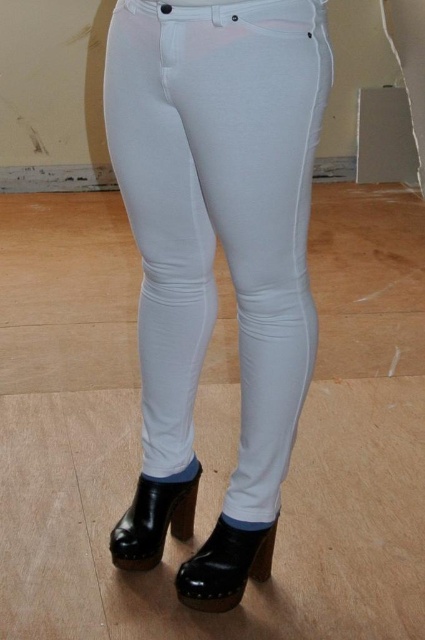
Does white smooth pants at center appear over black leather boot at lower center?

Indeed, white smooth pants at center is positioned over black leather boot at lower center.

Image resolution: width=425 pixels, height=640 pixels. What do you see at coordinates (220, 216) in the screenshot?
I see `white smooth pants at center` at bounding box center [220, 216].

Does point (178, 164) come closer to viewer compared to point (163, 502)?

That is True.

Find the location of a particular element. Image resolution: width=425 pixels, height=640 pixels. white smooth pants at center is located at coordinates (220, 216).

Does glossy patent leather boot at lower center have a smaller size compared to black leather boot at lower center?

Correct, glossy patent leather boot at lower center occupies less space than black leather boot at lower center.

Which is in front, point (209, 584) or point (122, 541)?

Point (209, 584) is in front.

Identify the location of glossy patent leather boot at lower center. (226, 566).

Can you confirm if white smooth pants at center is taller than glossy patent leather boot at lower center?

Correct, white smooth pants at center is much taller as glossy patent leather boot at lower center.

Who is more forward, (232,211) or (226,554)?

Point (232,211) is in front.

Which is in front, point (192, 93) or point (244, 544)?

Point (192, 93)

In order to click on white smooth pants at center in this screenshot , I will do `click(220, 216)`.